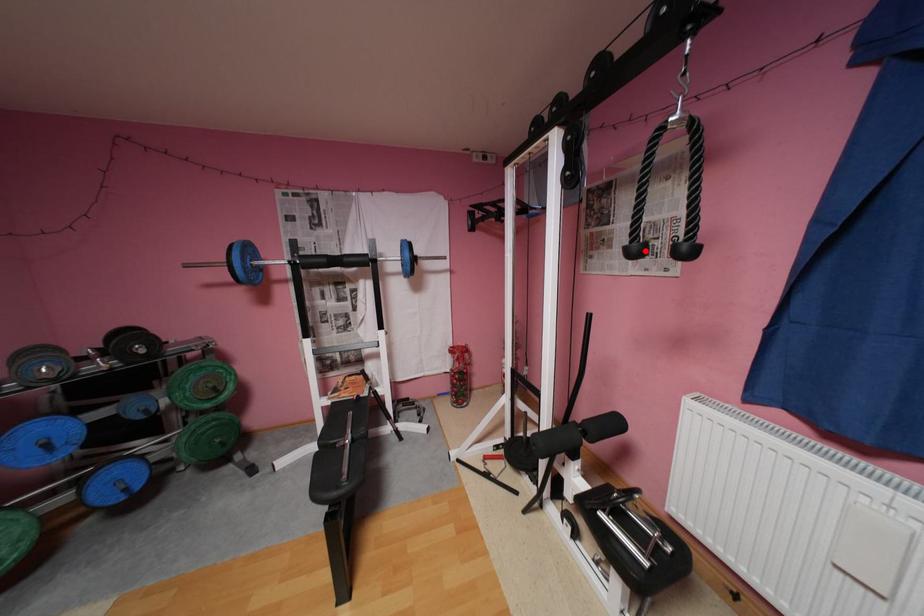
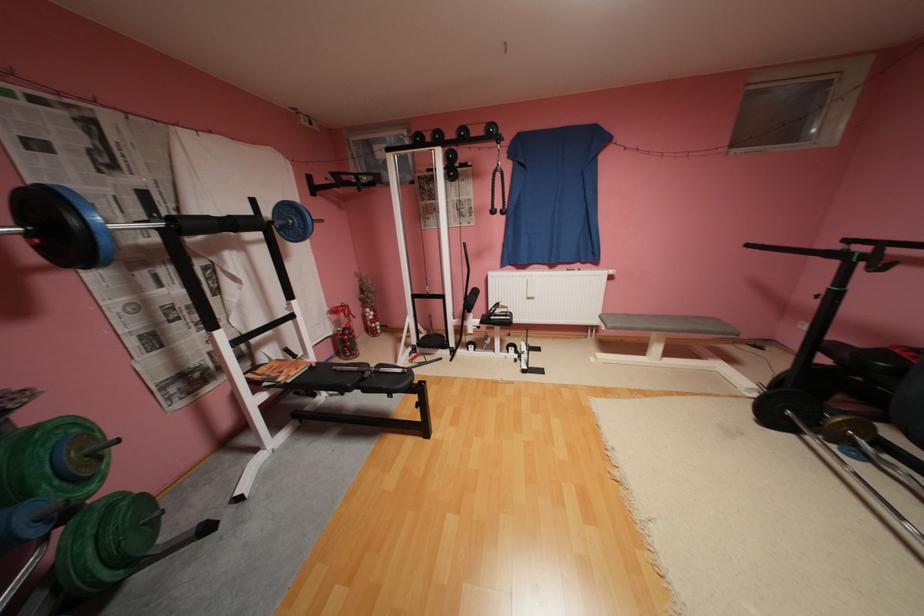
Where in the second image is the point corresponding to the highlighted location from the first image?

(502, 212)